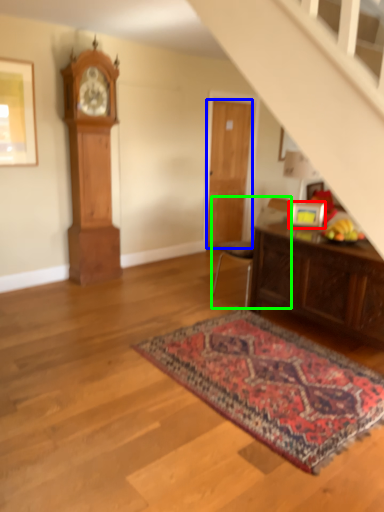
Question: Which object is the farthest from picture frame (highlighted by a red box)? Choose among these: door (highlighted by a blue box) or chair (highlighted by a green box).

Choices:
 (A) door
 (B) chair

Answer: (A)